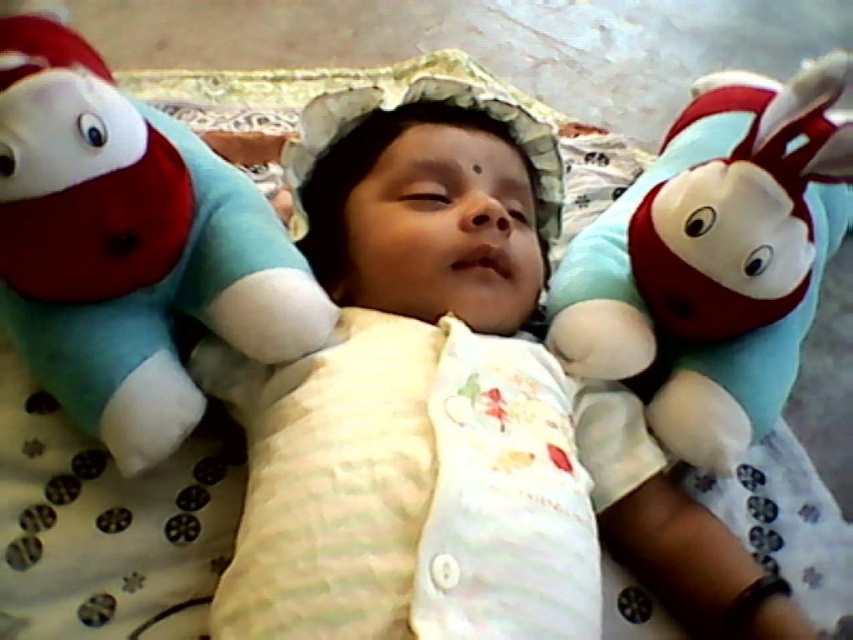
You are a photographer setting up a photo shoot for the baby. You need to ensure that the white soft baby at center is positioned so that it is wider than the soft plush toy at left. Is the current arrangement suitable for this requirement?

The white soft baby at center is wider than the soft plush toy at left, so the current arrangement is suitable for the requirement.

You are a parent looking at your baby sleeping between two soft plush toys. Which toy is closer to the baby? Please choose between the soft plush toy at left and the soft plush toy at right.

Both soft plush toys are equally close to the baby since they are positioned on either side of the baby.

You are a photographer taking a picture of the baby. You need to place a sticker at point A and point B. Point A is at coordinates point (405,332) and point B is at coordinates point (733,381). Which point is closer to the baby?

Point A at coordinates point (405,332) is closer to the baby because it is in front of point B at coordinates point (733,381).